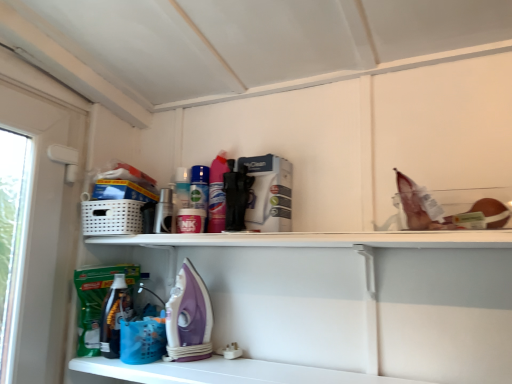
Question: Choose the correct answer: Is purple plastic iron at lower center inside blue plastic basket at lower center or outside it?

Choices:
 (A) inside
 (B) outside

Answer: (B)

Question: Is point (179, 357) positioned closer to the camera than point (154, 342)?

Choices:
 (A) closer
 (B) farther

Answer: (A)

Question: Which object is the farthest from the purple plastic iron at lower center?

Choices:
 (A) blue plastic basket at lower center
 (B) white glossy shelf at lower center

Answer: (B)

Question: Which of these objects is positioned closest to the purple plastic iron at lower center?

Choices:
 (A) blue plastic basket at lower center
 (B) white glossy shelf at lower center

Answer: (A)